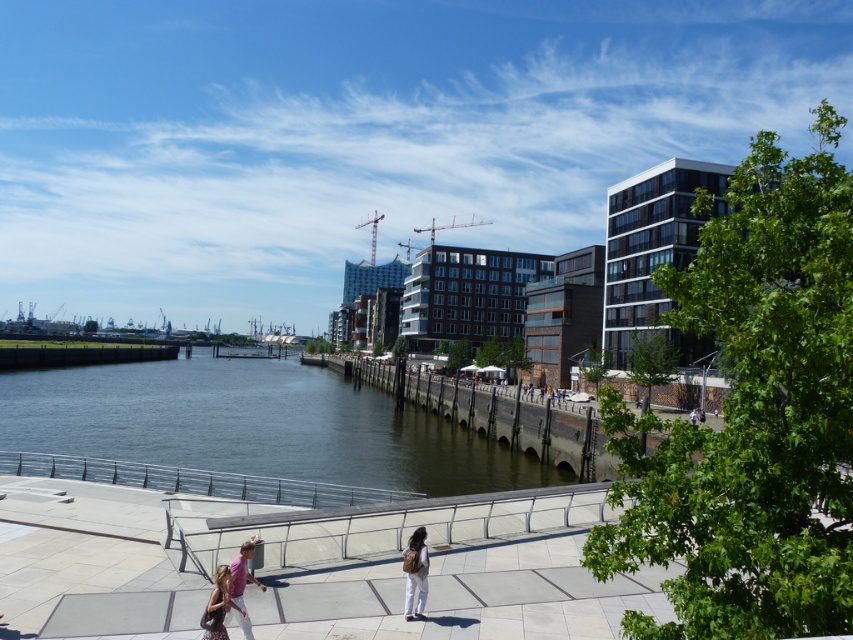
Question: Which object is positioned closest to the dark gray concrete river at center?

Choices:
 (A) light brown backpack at center
 (B) pink fabric at lower center
 (C) matte pink backpack at lower left

Answer: (B)

Question: Is light brown backpack at center above pink fabric at lower center?

Choices:
 (A) yes
 (B) no

Answer: (B)

Question: Can you confirm if light brown backpack at center is positioned below matte pink backpack at lower left?

Choices:
 (A) no
 (B) yes

Answer: (B)

Question: Which point is closer to the camera taking this photo?

Choices:
 (A) (238, 556)
 (B) (177, 461)

Answer: (A)

Question: Is dark gray concrete river at center smaller than light brown backpack at center?

Choices:
 (A) yes
 (B) no

Answer: (B)

Question: Which point is closer to the camera?

Choices:
 (A) matte pink backpack at lower left
 (B) light brown backpack at center

Answer: (A)